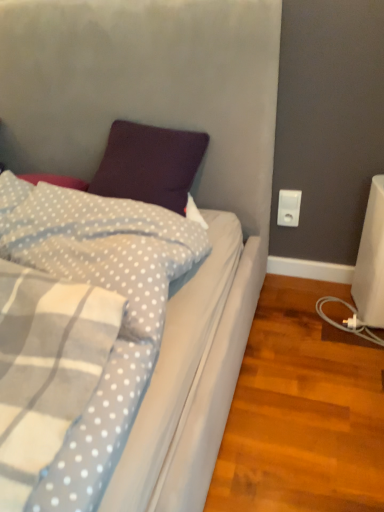
Question: Considering the relative positions of light purple plush pillow at upper left and white plastic power plug at right in the image provided, is light purple plush pillow at upper left in front of white plastic power plug at right?

Choices:
 (A) yes
 (B) no

Answer: (A)

Question: Is there a large distance between light purple plush pillow at upper left and white plastic power plug at right?

Choices:
 (A) yes
 (B) no

Answer: (B)

Question: Is light purple plush pillow at upper left shorter than white plastic power plug at right?

Choices:
 (A) no
 (B) yes

Answer: (A)

Question: From the image's perspective, is light purple plush pillow at upper left on top of white plastic power plug at right?

Choices:
 (A) yes
 (B) no

Answer: (B)

Question: Is white plastic power plug at right surrounded by light purple plush pillow at upper left?

Choices:
 (A) yes
 (B) no

Answer: (B)

Question: Can you confirm if light purple plush pillow at upper left is positioned to the left of white plastic power plug at right?

Choices:
 (A) yes
 (B) no

Answer: (A)

Question: Is white plastic power plug at right positioned with its back to light purple plush pillow at upper left?

Choices:
 (A) yes
 (B) no

Answer: (B)

Question: Could you tell me if white plastic power plug at right is facing light purple plush pillow at upper left?

Choices:
 (A) no
 (B) yes

Answer: (A)

Question: From a real-world perspective, is white plastic power plug at right positioned under light purple plush pillow at upper left based on gravity?

Choices:
 (A) yes
 (B) no

Answer: (A)

Question: Is white plastic power plug at right at the right side of light purple plush pillow at upper left?

Choices:
 (A) no
 (B) yes

Answer: (B)

Question: Does white plastic power plug at right come behind light purple plush pillow at upper left?

Choices:
 (A) yes
 (B) no

Answer: (A)

Question: Does white plastic power plug at right have a lesser width compared to light purple plush pillow at upper left?

Choices:
 (A) yes
 (B) no

Answer: (A)

Question: Is white plastic power plug at right wider or thinner than light purple plush pillow at upper left?

Choices:
 (A) thin
 (B) wide

Answer: (A)